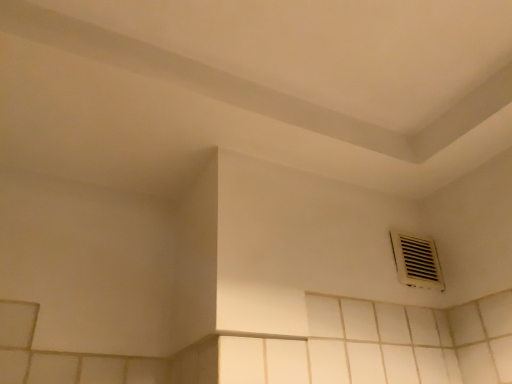
Consider the image. What is the approximate height of white plastic vent at upper right?

6.18 inches.

This screenshot has width=512, height=384. I want to click on white plastic vent at upper right, so click(416, 261).

Measure the distance between point (428, 254) and camera.

Point (428, 254) is 1.22 meters away from camera.

What do you see at coordinates (416, 261) in the screenshot? I see `white plastic vent at upper right` at bounding box center [416, 261].

Where is `white plastic vent at upper right`? The width and height of the screenshot is (512, 384). white plastic vent at upper right is located at coordinates (416, 261).